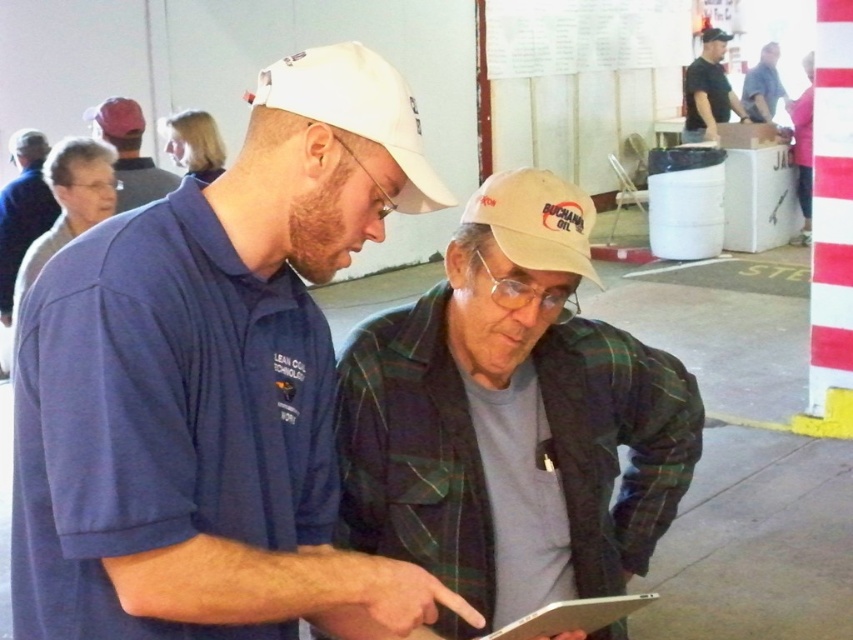
Who is positioned more to the right, matte blue shirt at center or white fabric baseball cap at center?

white fabric baseball cap at center is more to the right.

Which is behind, point (335, 72) or point (566, 200)?

The point (566, 200) is more distant.

Identify the location of matte blue shirt at center. The image size is (853, 640). (213, 385).

Is matte blue shirt at center bigger than plaid flannel shirt at center?

Yes, matte blue shirt at center is bigger than plaid flannel shirt at center.

Is point (309, 522) positioned in front of point (527, 253)?

Yes, it is in front of point (527, 253).

This screenshot has width=853, height=640. In order to click on matte blue shirt at center in this screenshot , I will do `click(213, 385)`.

Does plaid flannel shirt at center appear on the left side of blue plaid shirt at upper right?

Yes, plaid flannel shirt at center is to the left of blue plaid shirt at upper right.

Who is higher up, plaid flannel shirt at center or blue plaid shirt at upper right?

blue plaid shirt at upper right is higher up.

Does point (598, 448) come closer to viewer compared to point (747, 113)?

Yes.

The height and width of the screenshot is (640, 853). In order to click on plaid flannel shirt at center in this screenshot , I will do `click(512, 417)`.